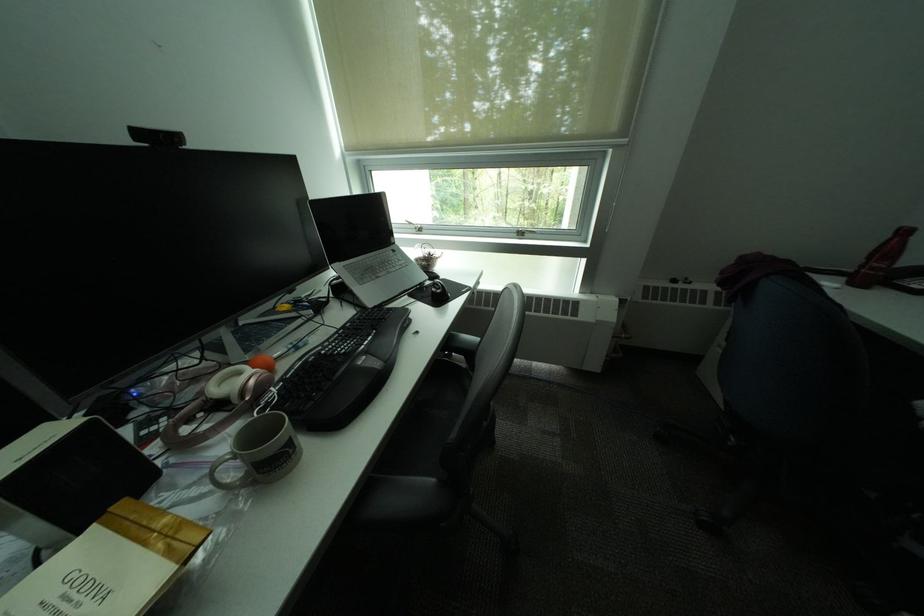
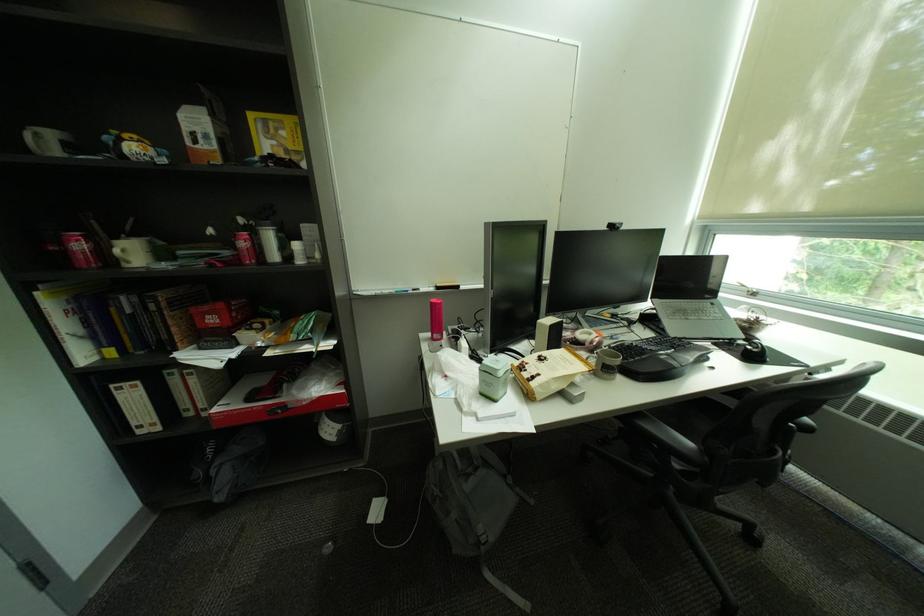
Find the pixel in the second image that matches (x=150, y=134) in the first image.

(621, 227)